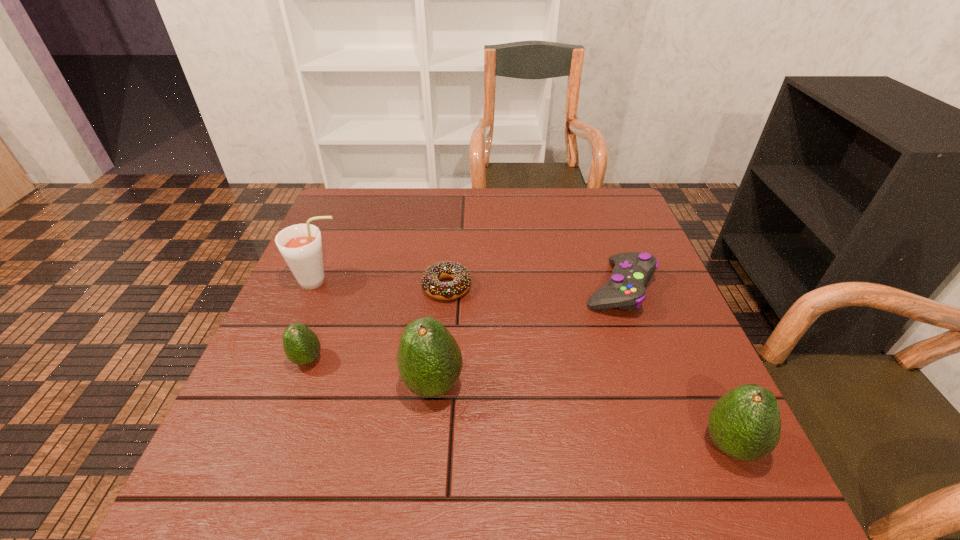
Identify the location of vacant position in the image that satisfies the following two spatial constraints: 1. on the drink side of the root beer; 2. on the right side of the fourth tallest object. (286, 360).

The height and width of the screenshot is (540, 960). I want to click on vacant space that satisfies the following two spatial constraints: 1. on the back side of the second avocado from left to right; 2. on the drink side of the root beer, so click(443, 281).

In order to click on free spot that satisfies the following two spatial constraints: 1. on the drink side of the root beer; 2. on the back side of the fourth shortest object in this screenshot , I will do `click(251, 445)`.

I want to click on free location that satisfies the following two spatial constraints: 1. on the back side of the third shortest object; 2. on the drink side of the root beer, so click(x=336, y=281).

I want to click on free spot that satisfies the following two spatial constraints: 1. on the drink side of the root beer; 2. on the left side of the second avocado from right to left, so click(x=276, y=385).

Find the location of a particular element. The width and height of the screenshot is (960, 540). free point that satisfies the following two spatial constraints: 1. on the drink side of the root beer; 2. on the back side of the second avocado from left to right is located at coordinates click(276, 385).

The width and height of the screenshot is (960, 540). Find the location of `free space that satisfies the following two spatial constraints: 1. on the back side of the doughnut; 2. on the drink side of the root beer`. free space that satisfies the following two spatial constraints: 1. on the back side of the doughnut; 2. on the drink side of the root beer is located at coordinates (447, 281).

Locate an element on the screen. Image resolution: width=960 pixels, height=540 pixels. vacant space that satisfies the following two spatial constraints: 1. on the back side of the second tallest avocado; 2. on the drink side of the root beer is located at coordinates (656, 281).